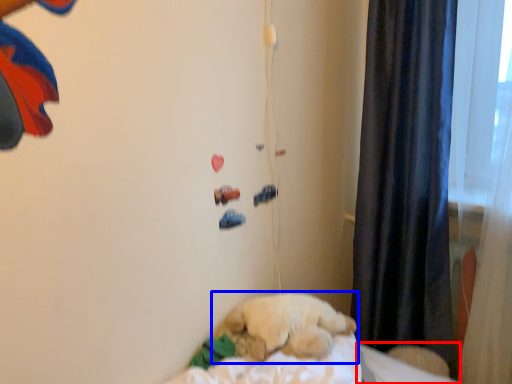
Question: Among these objects, which one is farthest to the camera, sheet (highlighted by a red box) or dog (highlighted by a blue box)?

Choices:
 (A) sheet
 (B) dog

Answer: (A)